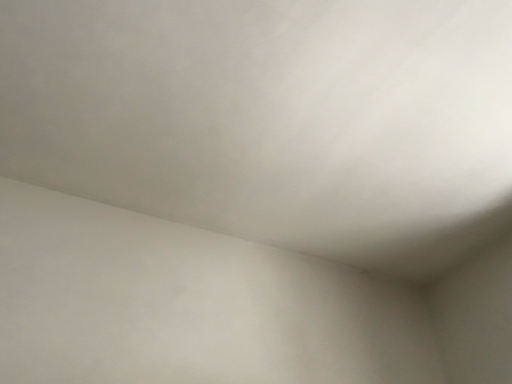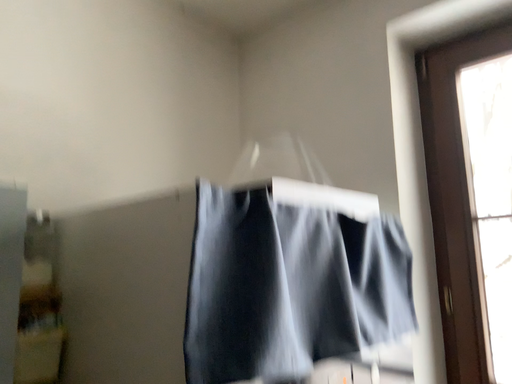
Question: Which way did the camera rotate in the video?

Choices:
 (A) rotated right
 (B) rotated left

Answer: (A)